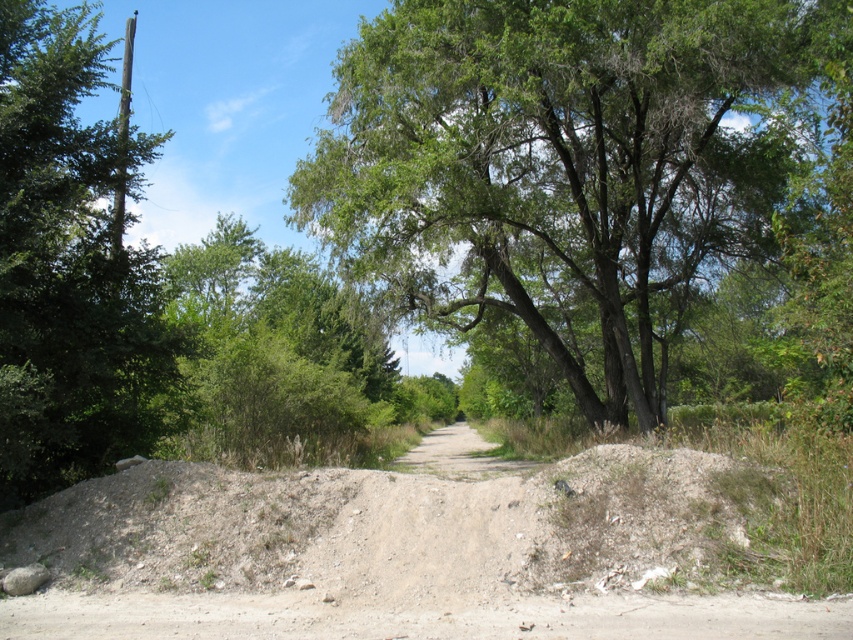
Question: Which point is closer to the camera?

Choices:
 (A) green leafy tree at left
 (B) green leafy tree at center
 (C) dirt/gravel path at center
 (D) brown sandy dirt at center

Answer: (D)

Question: Which of these objects is positioned closest to the green leafy tree at center?

Choices:
 (A) green leafy tree at left
 (B) dirt/gravel path at center

Answer: (B)

Question: Is green leafy tree at center behind green leafy tree at left?

Choices:
 (A) no
 (B) yes

Answer: (B)

Question: Does green leafy tree at center appear under green leafy tree at left?

Choices:
 (A) no
 (B) yes

Answer: (B)

Question: Is brown sandy dirt at center thinner than dirt/gravel path at center?

Choices:
 (A) no
 (B) yes

Answer: (B)

Question: Which of the following is the farthest from the observer?

Choices:
 (A) dirt/gravel path at center
 (B) green leafy tree at left

Answer: (A)